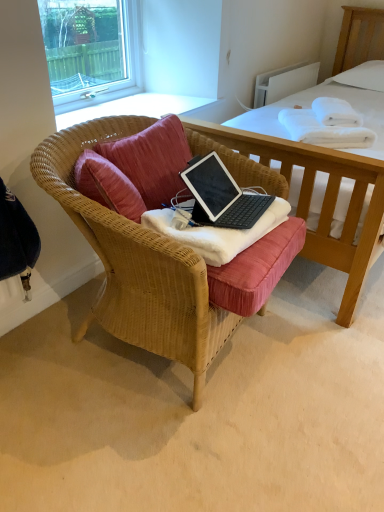
Question: Is white soft blanket at center, positioned as the 2th blanket in top-to-bottom order, in contact with white soft towel at upper right, the 1th blanket positioned from the back?

Choices:
 (A) no
 (B) yes

Answer: (A)

Question: Is white soft blanket at center, which is the 2th blanket in right-to-left order, positioned in front of white soft towel at upper right, the 1th blanket from the top?

Choices:
 (A) yes
 (B) no

Answer: (A)

Question: Is white soft blanket at center, which ranks as the first blanket in front-to-back order, positioned behind white soft towel at upper right, the 1th blanket from the top?

Choices:
 (A) no
 (B) yes

Answer: (A)

Question: From a real-world perspective, is white soft blanket at center, which ranks as the first blanket in front-to-back order, positioned under white soft towel at upper right, the 1th blanket positioned from the back, based on gravity?

Choices:
 (A) no
 (B) yes

Answer: (B)

Question: Does white soft blanket at center, which is counted as the second blanket, starting from the back, have a greater height compared to white soft towel at upper right, the 1th blanket from the top?

Choices:
 (A) no
 (B) yes

Answer: (A)

Question: Is white soft towel at upper right, the 1th blanket when ordered from right to left, to the left or to the right of woven wood chair at center in the image?

Choices:
 (A) right
 (B) left

Answer: (A)

Question: From the image's perspective, is white soft towel at upper right, the 1th blanket positioned from the back, above or below woven wood chair at center?

Choices:
 (A) below
 (B) above

Answer: (B)

Question: In terms of width, does white soft towel at upper right, positioned as the second blanket in bottom-to-top order, look wider or thinner when compared to woven wood chair at center?

Choices:
 (A) wide
 (B) thin

Answer: (B)

Question: Is white soft towel at upper right, the 1th blanket from the top, inside or outside of woven wood chair at center?

Choices:
 (A) outside
 (B) inside

Answer: (A)

Question: From a real-world perspective, is white cotton bed at center physically located above or below clear glass window at upper left?

Choices:
 (A) below
 (B) above

Answer: (A)

Question: In terms of height, does white cotton bed at center look taller or shorter compared to clear glass window at upper left?

Choices:
 (A) tall
 (B) short

Answer: (A)

Question: Do you think white cotton bed at center is within clear glass window at upper left, or outside of it?

Choices:
 (A) outside
 (B) inside

Answer: (A)

Question: Is white cotton bed at center to the left or to the right of clear glass window at upper left in the image?

Choices:
 (A) right
 (B) left

Answer: (A)

Question: Would you say clear glass window at upper left is to the left or to the right of pink fabric pillow at center in the picture?

Choices:
 (A) right
 (B) left

Answer: (B)

Question: Looking at their shapes, would you say clear glass window at upper left is wider or thinner than pink fabric pillow at center?

Choices:
 (A) wide
 (B) thin

Answer: (B)